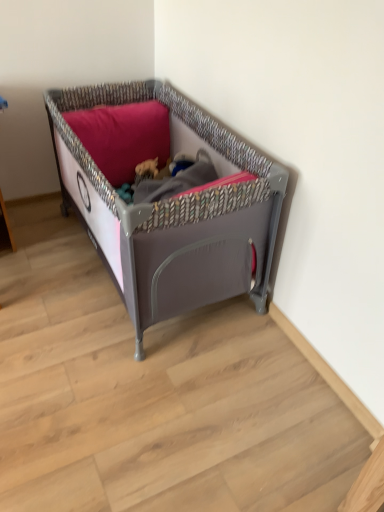
Locate an element on the screen. The image size is (384, 512). free space in front of matte gray plastic playpen at center is located at coordinates (150, 389).